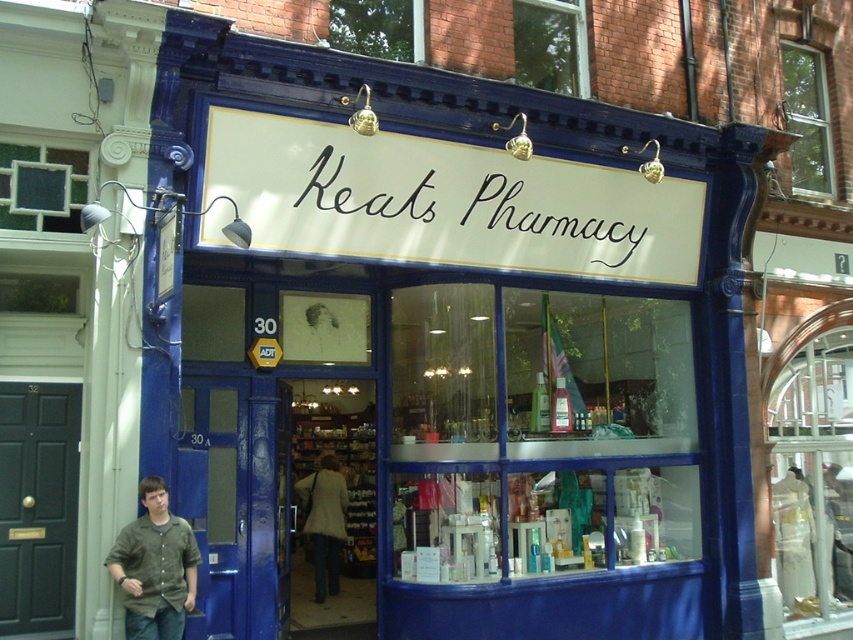
Who is lower down, white painted wood sign at center or green cotton shirt at lower left?

Positioned lower is green cotton shirt at lower left.

Which is behind, point (691, 195) or point (181, 616)?

The point (691, 195) is behind.

Is point (628, 172) closer to viewer compared to point (178, 525)?

No, it is behind (178, 525).

Find the location of `white painted wood sign at center`. white painted wood sign at center is located at coordinates (447, 202).